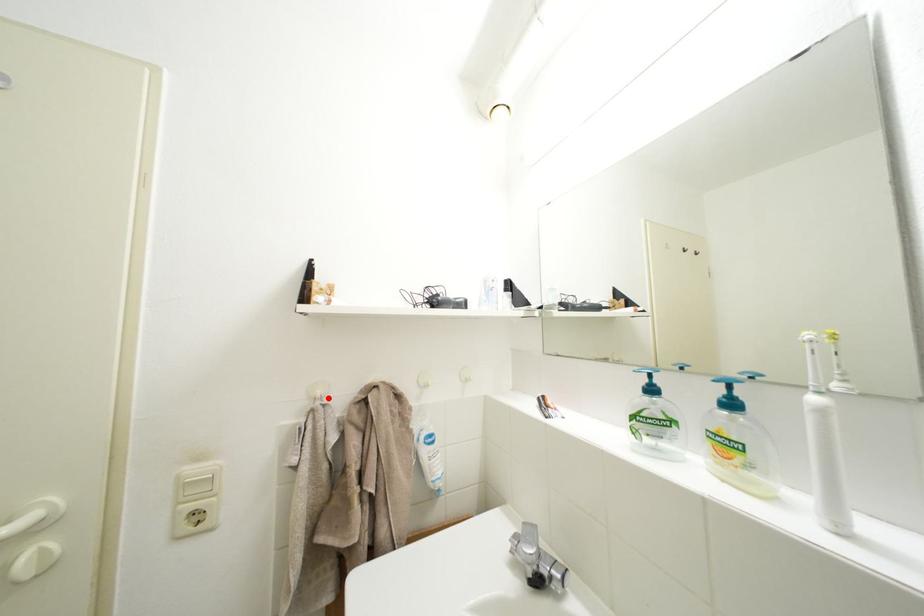
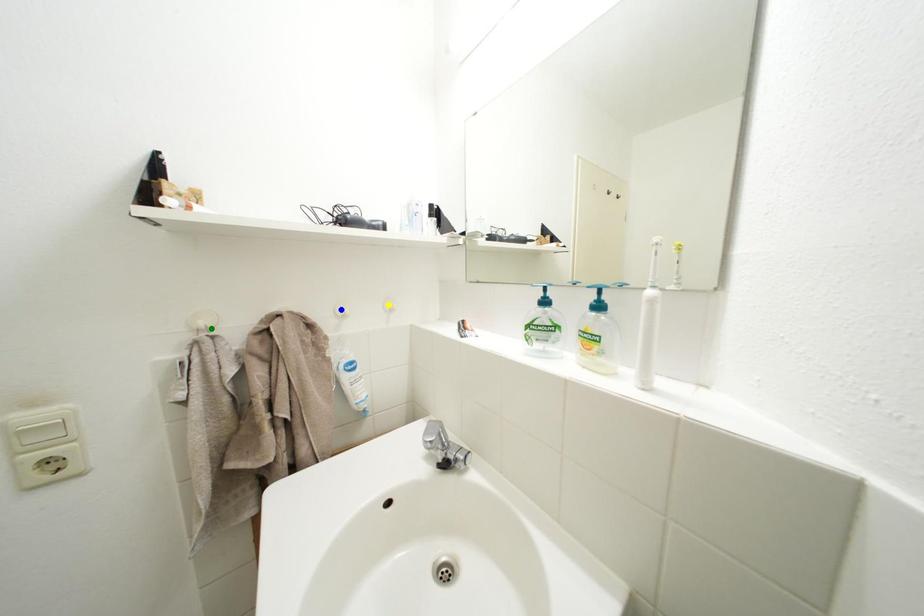
Question: I am providing you with two images of the same scene from different viewpoints. A red point is marked on the first image. You are given multiple points on the second image. In image 2, which mark is for the same physical point as the one in image 1?

Choices:
 (A) yellow point
 (B) green point
 (C) blue point

Answer: (B)